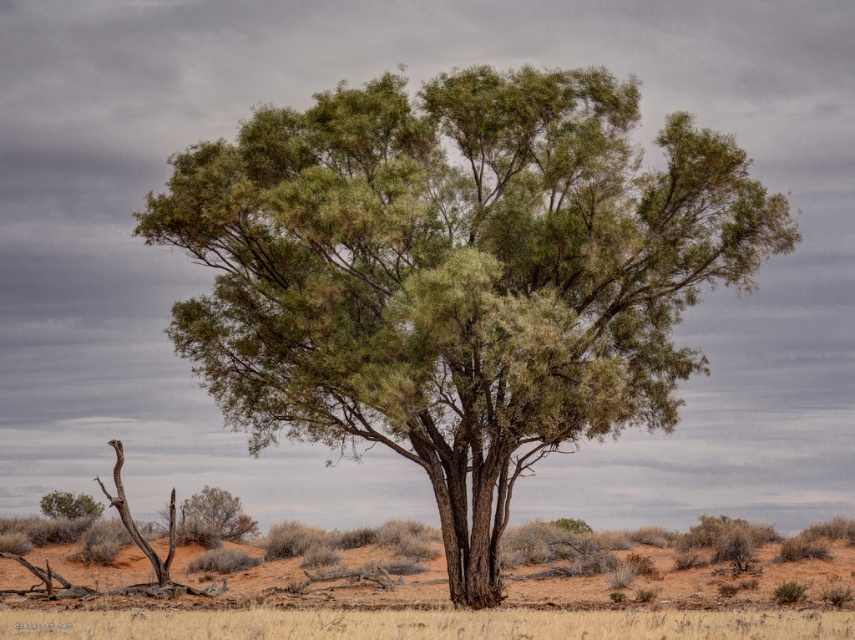
You are navigating through the desert and see two points marked on your map. The first point is at point (493, 205) and the second is at point (187, 538). Which point is closer to you as you approach the solitary acacia tree?

Point (493, 205) is in front of point (187, 538), so it is closer to you as you approach the solitary acacia tree.

You are a hiker trying to navigate through the desert and you see the dry grass at center and the green leafy shrub at lower left. Which one is higher up in the image?

The dry grass at center is above the green leafy shrub at lower left, so the dry grass at center is higher up in the image.

You are a hiker trying to navigate through the desert. You see dry grass at center and green leafy shrub at lower left. Which direction should you go to find the shrub from your current position?

The dry grass at center is to the right of the green leafy shrub at lower left, so to find the green leafy shrub at lower left, you should go to the left from the dry grass at center.